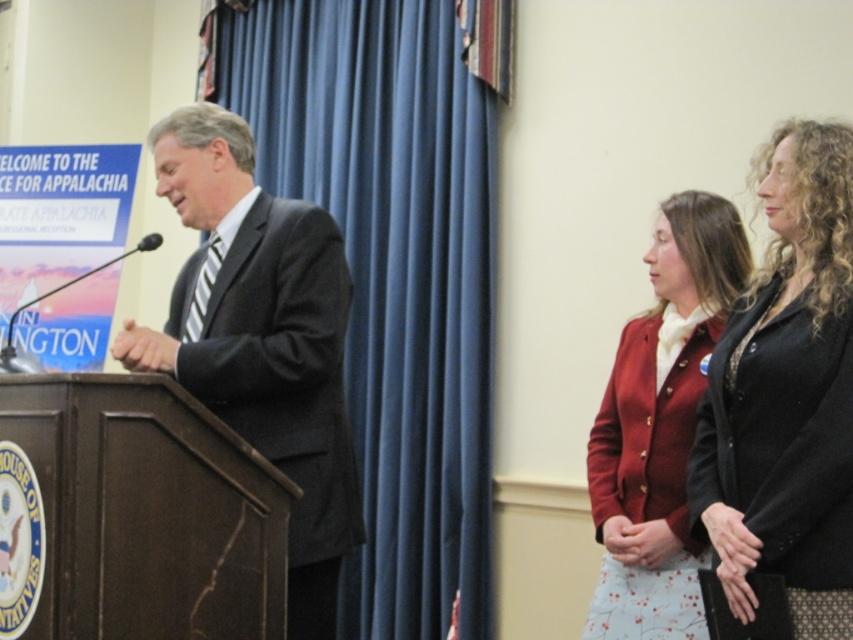
You are an attendee at the event and want to take a photo of the speaker. The blue fabric curtain at center and the black matte blazer at right are both in your camera frame. Which object should you focus on to ensure the speaker is in focus?

The blue fabric curtain at center is further to the viewer than the black matte blazer at right, so focusing on the blue fabric curtain at center will ensure the speaker, who is wearing the black matte blazer at right, is in focus since it is closer to the camera.

You are standing at a conference venue and need to place a 2.5 meter long banner. The banner must be placed exactly at point [451,381]. Considering the distance from where you are standing to that point, will the banner fit without overlapping any existing structures?

The distance between the viewer and point [451,381] is 3.59 meters. Since the banner is only 2.5 meters long, it will fit without overlapping any existing structures as there is sufficient space.

You are an event organizer who needs to adjust the stage setup. The blue fabric curtain at center and the black matte blazer at right are in the way of the new lighting setup. Which object should you move first to access the area behind them?

The blue fabric curtain at center should be moved first because it is positioned on the left side of the black matte blazer at right, meaning it is closer to the area needing access for the new lighting setup.